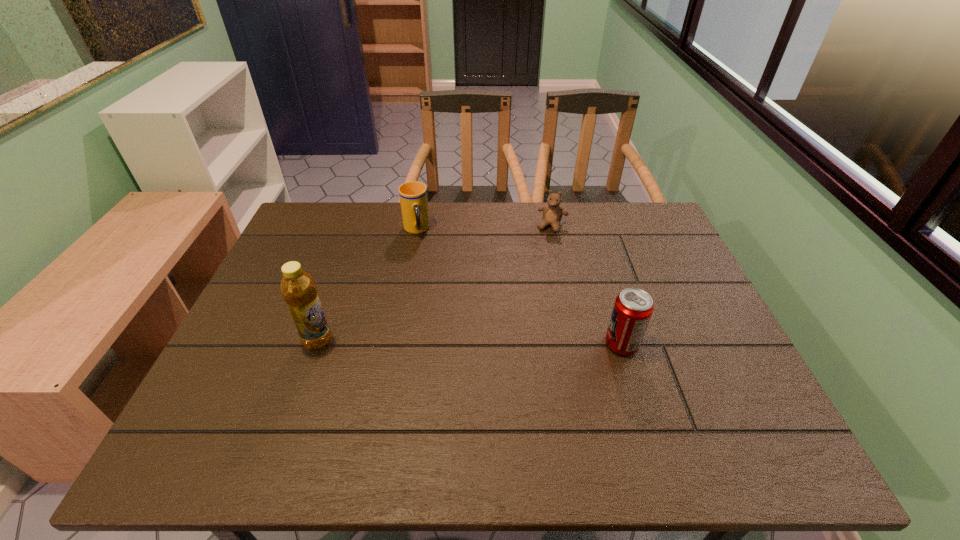
The height and width of the screenshot is (540, 960). In order to click on free spot between the rightmost object and the tallest object in this screenshot , I will do `click(469, 342)`.

Where is `the closest object to the leftmost object`? the closest object to the leftmost object is located at coordinates (413, 195).

The height and width of the screenshot is (540, 960). Identify the location of the second closest object to the shortest object. (633, 307).

You are a GUI agent. You are given a task and a screenshot of the screen. Output one action in this format:
    pyautogui.click(x=<x>, y=<y>)
    Task: Click on the blank area in the image that satisfies the following two spatial constraints: 1. on the back side of the bottle; 2. on the right side of the teddy bear
    
    Given the screenshot: What is the action you would take?
    pyautogui.click(x=358, y=226)

The height and width of the screenshot is (540, 960). Find the location of `free space that satisfies the following two spatial constraints: 1. on the back side of the leftmost object; 2. on the left side of the cup`. free space that satisfies the following two spatial constraints: 1. on the back side of the leftmost object; 2. on the left side of the cup is located at coordinates (357, 230).

Locate an element on the screen. This screenshot has width=960, height=540. free space that satisfies the following two spatial constraints: 1. on the front side of the second object from right to left; 2. on the left side of the rightmost object is located at coordinates (577, 344).

You are a GUI agent. You are given a task and a screenshot of the screen. Output one action in this format:
    pyautogui.click(x=<x>, y=<y>)
    Task: Click on the vacant space that satisfies the following two spatial constraints: 1. on the front side of the leftmost object; 2. on the right side of the soda can
    This screenshot has width=960, height=540.
    Given the screenshot: What is the action you would take?
    pyautogui.click(x=317, y=344)